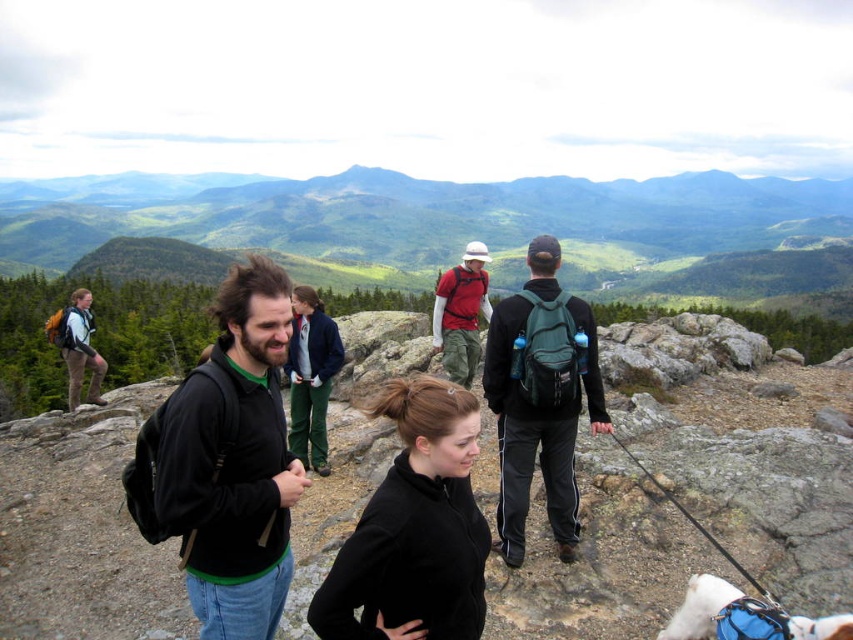
You are a photographer planning to take a photo of the green grassy mountain at upper center and the black matte sweater at center. Which object should you focus on first if you want to capture both in the same frame without moving the camera?

The green grassy mountain at upper center is wider than the black matte sweater at center, so you should focus on the black matte sweater at center first to ensure both fit within the frame.

You are a hiker who wants to know which clothing item takes up more space between the black matte jacket at center and the black matte sweater at center. Which one is wider?

The black matte jacket at center is wider than the black matte sweater at center.

You are a photographer planning to take a photo of the green grassy mountain at upper center and the black matte jacket at center. Based on their sizes in the image, which object would appear larger in your photo?

The green grassy mountain at upper center might be wider than the black matte jacket at center, so it would likely appear larger in the photo.